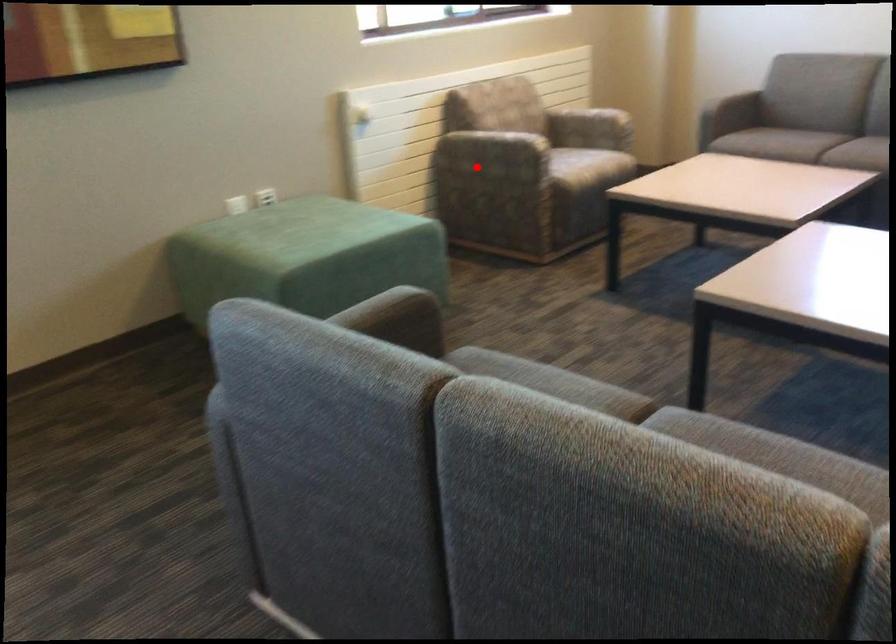
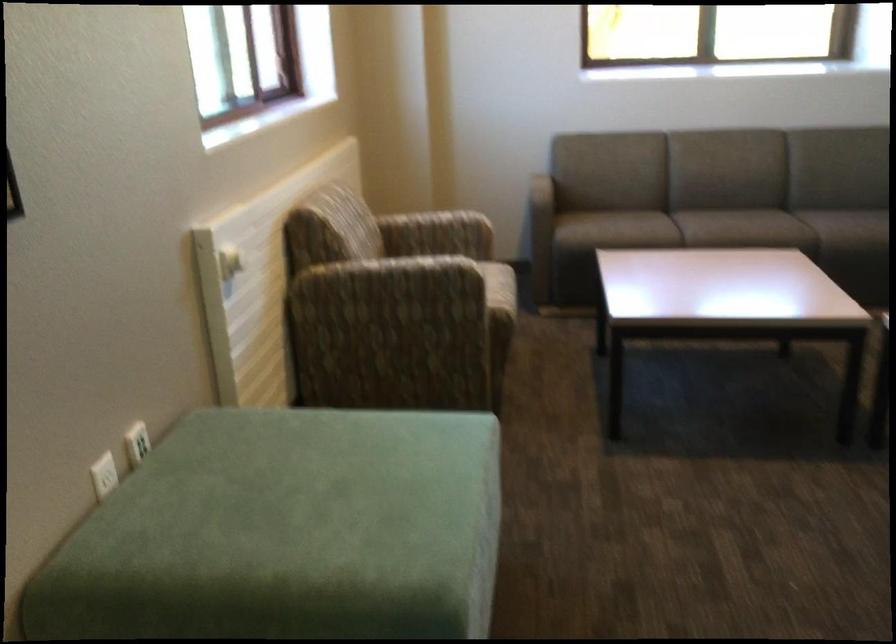
Question: I am providing you with two images of the same scene from different viewpoints. Image1 has a red point marked. In image2, the corresponding 3D location appears at what relative position? Reply with the corresponding letter.

Choices:
 (A) Closer
 (B) Farther

Answer: (A)